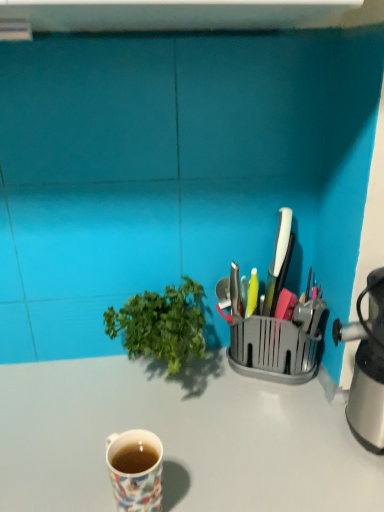
Question: From a real-world perspective, is floral ceramic mug at lower left above or below white glossy desk at center?

Choices:
 (A) above
 (B) below

Answer: (A)

Question: Is floral ceramic mug at lower left to the left or to the right of white glossy desk at center in the image?

Choices:
 (A) right
 (B) left

Answer: (B)

Question: Which of these objects is positioned farthest from the floral ceramic mug at lower left?

Choices:
 (A) white glossy desk at center
 (B) green leafy plant at center
 (C) metallic silver knife block at right

Answer: (C)

Question: Which is nearer to the green leafy plant at center?

Choices:
 (A) metallic silver knife block at right
 (B) floral ceramic mug at lower left
 (C) white glossy desk at center

Answer: (A)